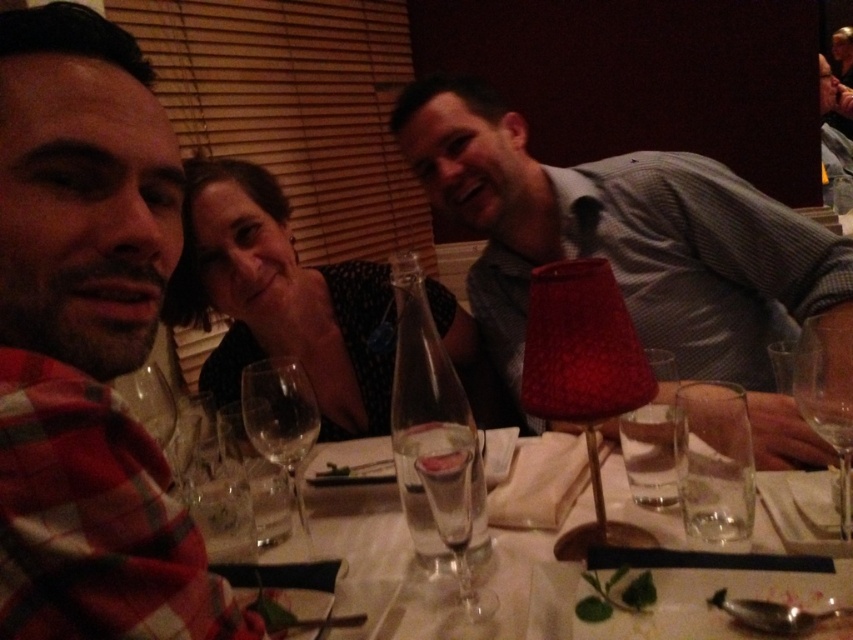
Between matte gray shirt at center and transparent glass wine glass at right, which one has more height?

With more height is matte gray shirt at center.

Is matte gray shirt at center behind transparent glass wine glass at right?

Yes, it is.

Does point (485, 218) come closer to viewer compared to point (831, 330)?

No, (485, 218) is behind (831, 330).

Locate an element on the screen. matte gray shirt at center is located at coordinates (631, 248).

Where is `clear glass water at center`? clear glass water at center is located at coordinates (376, 566).

From the picture: Between clear glass water at center and transparent glass wine glass at right, which one has more height?

transparent glass wine glass at right is taller.

Is point (341, 576) farther from camera compared to point (839, 460)?

No, (341, 576) is closer to viewer.

The image size is (853, 640). I want to click on clear glass water at center, so click(376, 566).

Is clear glass water at center smaller than transparent glass wine glass at center?

No, clear glass water at center is not smaller than transparent glass wine glass at center.

In the scene shown: Who is positioned more to the left, clear glass water at center or transparent glass wine glass at center?

transparent glass wine glass at center is more to the left.

Which is in front, point (321, 548) or point (300, 451)?

Point (300, 451)

You are a GUI agent. You are given a task and a screenshot of the screen. Output one action in this format:
    pyautogui.click(x=<x>, y=<y>)
    Task: Click on the clear glass water at center
    Image resolution: width=853 pixels, height=640 pixels.
    Given the screenshot: What is the action you would take?
    pyautogui.click(x=376, y=566)